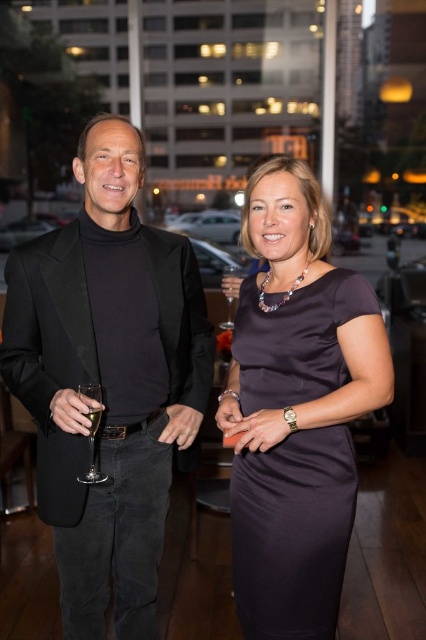
You are a photographer adjusting your camera settings to focus on two specific points in the image. The points are labeled as point [250,624] and point [83,413]. Which point is closer to your camera lens?

Point [250,624] is further to the camera than point [83,413], so the closer point to the camera lens is point [83,413].

You are a photographer at the event and want to capture the dress at center. The event coordinator mentioned that the dress has a unique design at point (x=293, y=532). Where exactly on the dress should you focus your camera?

The point (x=293, y=532) is on the satin dress at center, so you should focus your camera on the satin dress at center to capture the unique design there.